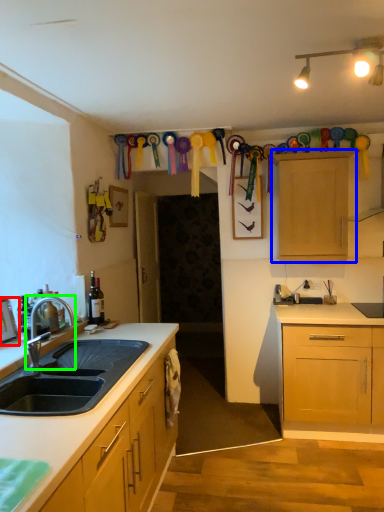
Question: Which object is the closest to the picture frame (highlighted by a red box)? Choose among these: cabinetry (highlighted by a blue box) or tap (highlighted by a green box).

Choices:
 (A) cabinetry
 (B) tap

Answer: (B)